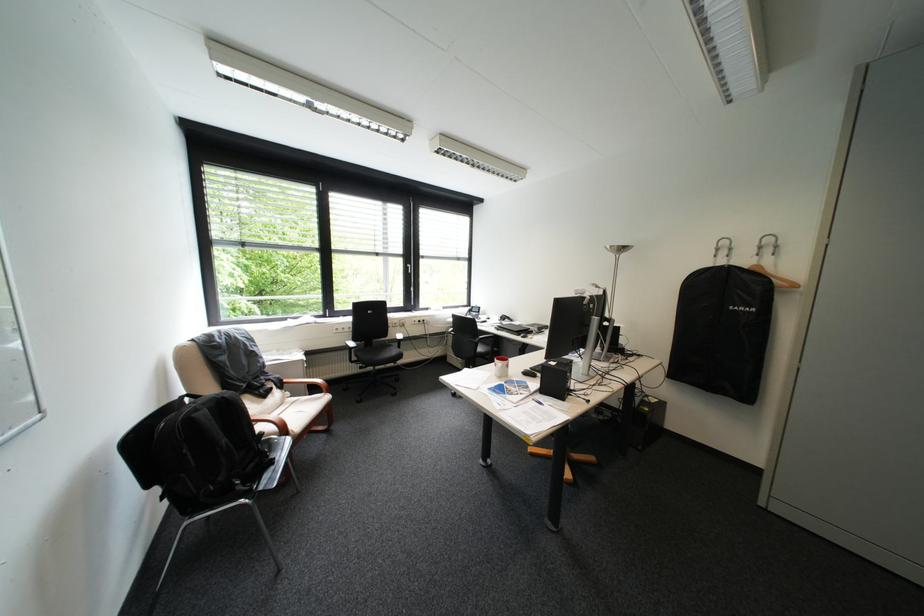
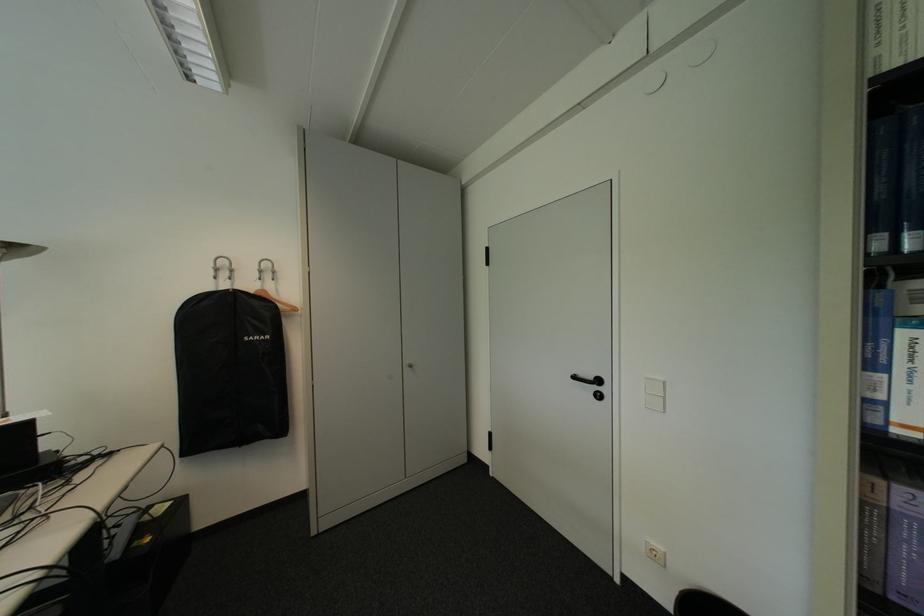
Question: The camera is either moving clockwise (left) or counter-clockwise (right) around the object. The first image is from the beginning of the video and the second image is from the end. Is the camera moving left or right when shooting the video?

Choices:
 (A) Left
 (B) Right

Answer: (A)